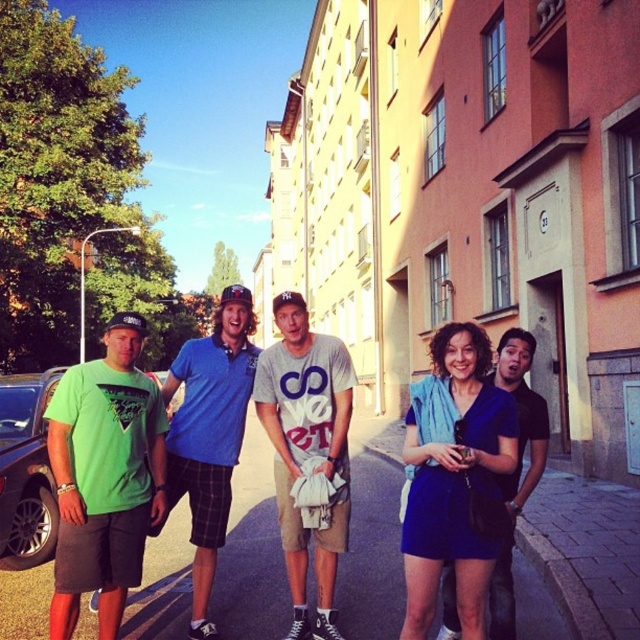
Question: Observing the image, what is the correct spatial positioning of green matte t-shirt at left in reference to matte blue t-shirt at center?

Choices:
 (A) above
 (B) below

Answer: (A)

Question: Does gray cotton t-shirt at center appear under blue cotton polo shirt at center?

Choices:
 (A) no
 (B) yes

Answer: (A)

Question: Which of the following is the farthest from the observer?

Choices:
 (A) (499, 348)
 (B) (1, 564)
 (C) (134, 509)

Answer: (B)

Question: Which point is farther from the camera taking this photo?

Choices:
 (A) (33, 483)
 (B) (369, 461)
 (C) (8, 566)
 (D) (227, 472)

Answer: (B)

Question: Considering the relative positions of green matte t-shirt at left and matte blue t-shirt at center in the image provided, where is green matte t-shirt at left located with respect to matte blue t-shirt at center?

Choices:
 (A) left
 (B) right

Answer: (A)

Question: Which of the following is the farthest from the observer?

Choices:
 (A) blue cotton polo shirt at center
 (B) green fabric t-shirt at left
 (C) matte blue t-shirt at center
 (D) matte asphalt pavement at center

Answer: (D)